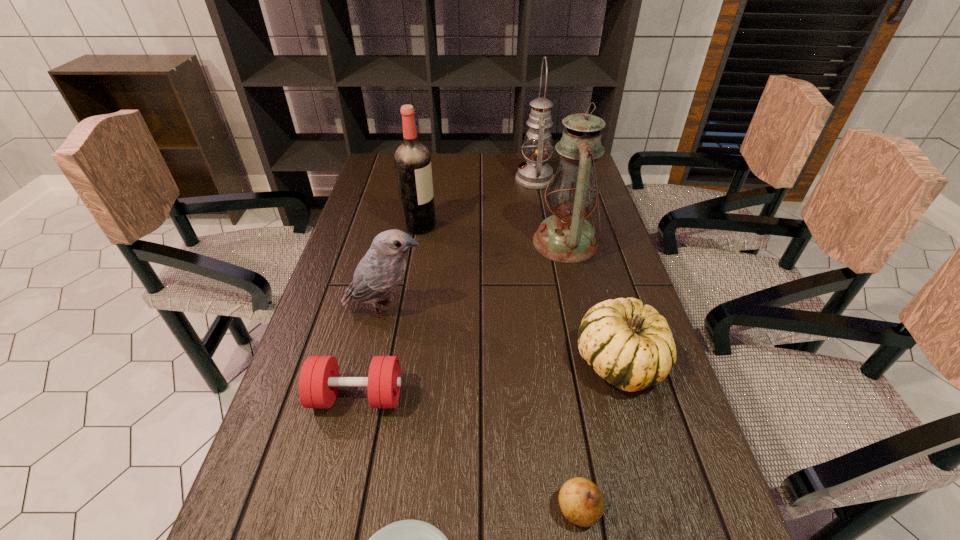
Locate an element on the screen. This screenshot has height=540, width=960. free space at the far edge of the desktop is located at coordinates (442, 179).

Find the location of a particular element. This screenshot has height=540, width=960. vacant space at the left edge is located at coordinates (345, 333).

The height and width of the screenshot is (540, 960). In order to click on vacant region at the right edge in this screenshot , I will do (x=694, y=535).

You are a GUI agent. You are given a task and a screenshot of the screen. Output one action in this format:
    pyautogui.click(x=<x>, y=<y>)
    Task: Click on the free space between the dumbbell and the gourd
    The height and width of the screenshot is (540, 960).
    Given the screenshot: What is the action you would take?
    pyautogui.click(x=488, y=380)

In order to click on vacant area that lies between the nearer oil lamp and the gourd in this screenshot , I will do `click(592, 302)`.

You are a GUI agent. You are given a task and a screenshot of the screen. Output one action in this format:
    pyautogui.click(x=<x>, y=<y>)
    Task: Click on the free space between the fifth nearest object and the farthest object
    The height and width of the screenshot is (540, 960).
    Given the screenshot: What is the action you would take?
    pyautogui.click(x=460, y=244)

The width and height of the screenshot is (960, 540). Find the location of `empty location between the nearer oil lamp and the pear`. empty location between the nearer oil lamp and the pear is located at coordinates (572, 376).

This screenshot has height=540, width=960. In order to click on empty space that is in between the pear and the fifth tallest object in this screenshot , I will do `click(599, 436)`.

This screenshot has height=540, width=960. Find the location of `vacant point located between the farthest object and the parrot`. vacant point located between the farthest object and the parrot is located at coordinates (460, 244).

Locate an element on the screen. This screenshot has width=960, height=540. vacant area that lies between the gourd and the fifth nearest object is located at coordinates (502, 336).